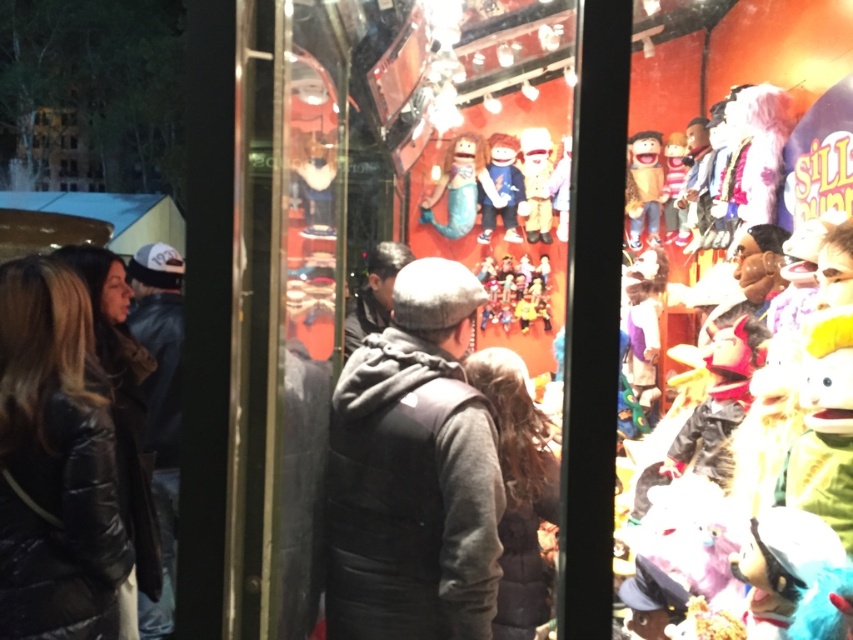
You are a delivery person trying to place a new display item in the storefront window. The new item is 1.2 meters wide. You see the matte blue fabric mermaid at center and the matte white plush toy at center. Can the new item fit between them if placed in the space currently occupied by the existing items?

The matte blue fabric mermaid at center might be wider than the matte white plush toy at center. Since the new item is 1.2 meters wide, we cannot determine if it will fit without knowing the exact width of the space between them. Please check the actual dimensions before placing the new item.

Consider the image. You are a delivery person who needs to place a small package between the matte wooden dolls at center and the yellow plush toy at right. Which object should you place the package closer to if you want it to be near the smaller object?

You should place the package closer to the yellow plush toy at right because it is smaller than the matte wooden dolls at center.

You are a customer looking at the storefront window display. You notice a point at coordinates (460, 186). Can you tell me what object this point is located on?

The point at coordinates (460, 186) is located on the matte blue fabric mermaid at center.